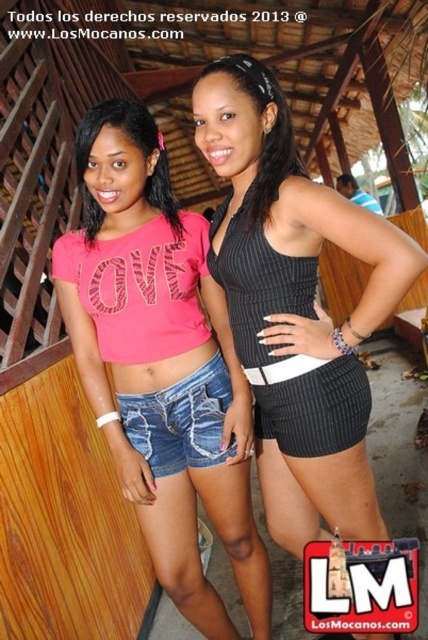
Is point (303, 522) in front of point (109, 109)?

No, (303, 522) is behind (109, 109).

Is black ribbed tank top at center thinner than pink matte shirt at upper left?

No, black ribbed tank top at center is not thinner than pink matte shirt at upper left.

Is point (244, 164) farther from camera compared to point (169, 214)?

No.

Where is `black ribbed tank top at center`? The height and width of the screenshot is (640, 428). black ribbed tank top at center is located at coordinates (296, 307).

In the scene shown: Is the position of denim shorts at center more distant than that of pink matte shirt at upper left?

Yes, denim shorts at center is further from the viewer.

Who is more forward, (x=192, y=440) or (x=91, y=236)?

Positioned in front is point (x=91, y=236).

At what (x,y) coordinates should I click in order to perform the action: click on denim shorts at center. Please return your answer as a coordinate pair (x, y). The height and width of the screenshot is (640, 428). Looking at the image, I should click on (181, 420).

Which is below, denim shorts at center or black ribbed shorts at center?

Positioned lower is denim shorts at center.

Is point (163, 433) in front of point (344, 412)?

No, (163, 433) is behind (344, 412).

Identify the location of denim shorts at center. (181, 420).